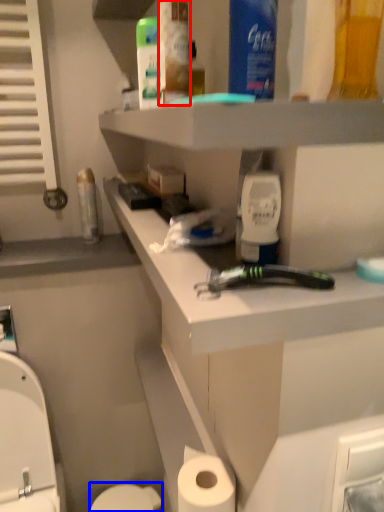
Question: Which object is further to the camera taking this photo, mouthwash (highlighted by a red box) or toilet bowl (highlighted by a blue box)?

Choices:
 (A) mouthwash
 (B) toilet bowl

Answer: (B)